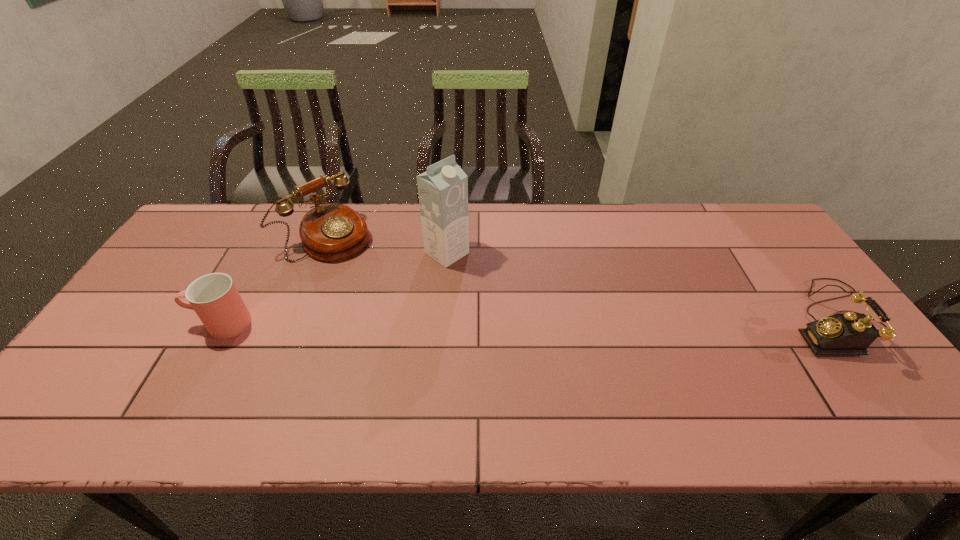
The image size is (960, 540). What are the coordinates of `the closest object to the second object from right to left` in the screenshot? It's located at (331, 232).

Image resolution: width=960 pixels, height=540 pixels. Find the location of `the third closest object to the cup`. the third closest object to the cup is located at coordinates (839, 334).

Identify the location of vacant region that satisfies the following two spatial constraints: 1. on the front side of the right telephone; 2. on the dial of the carton. (442, 319).

Find the location of `vacant region that satisfies the following two spatial constraints: 1. on the front side of the taller telephone; 2. on the dial of the shorter telephone`. vacant region that satisfies the following two spatial constraints: 1. on the front side of the taller telephone; 2. on the dial of the shorter telephone is located at coordinates (295, 319).